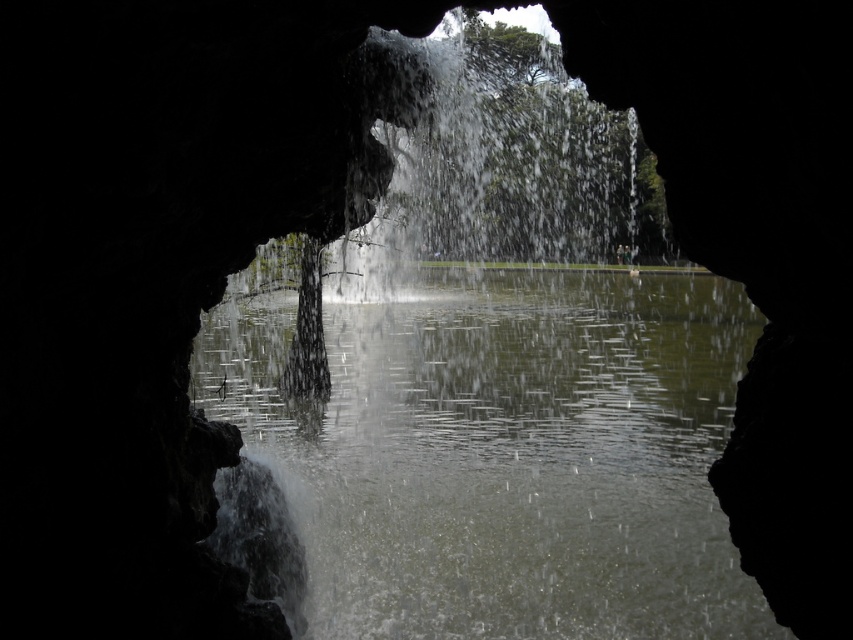
Looking at this image, you are standing inside the cave and want to cross the water area. The clear water at center and the white frothy water at center are both in your path. Which part of the water should you step on to avoid getting wet?

You should step on the clear water at center because it is bigger and likely calmer than the white frothy water at center, reducing the chance of splashing and getting wet.

You are standing inside the cave and want to take a photo of the clear water at center and the white frothy water at center. Which one is positioned to the left in the scene?

The clear water at center is positioned to the left of the white frothy water at center.

You are standing inside the cave and want to locate the clear water at center. According to the coordinates provided, where exactly should you look?

You should look at point (503, 452) to find the clear water at center.